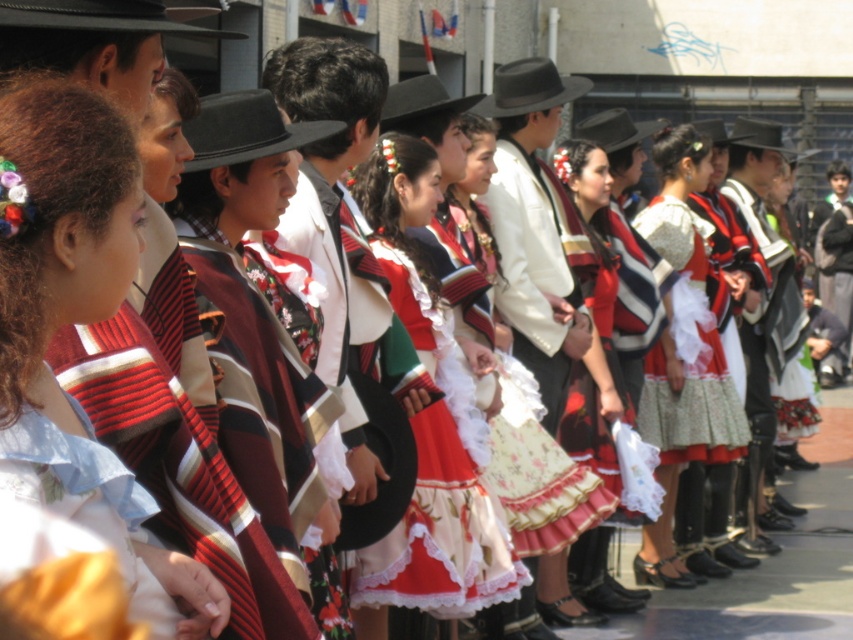
You are a photographer trying to capture a perfect shot of the matte striped dress at center and the matte red skirt at center. Since you want to ensure both are visible, you need to know their positions relative to each other. Which one is positioned to the left of the other?

The matte striped dress at center is to the left of the matte red skirt at center.

You are a photographer taking a picture of the matte striped dress at center and the matte red skirt at center. Which one should you focus on first if you want to capture both in the same frame?

The matte striped dress at center is located above the matte red skirt at center, so you should focus on the matte striped dress at center first to ensure both are in the frame.